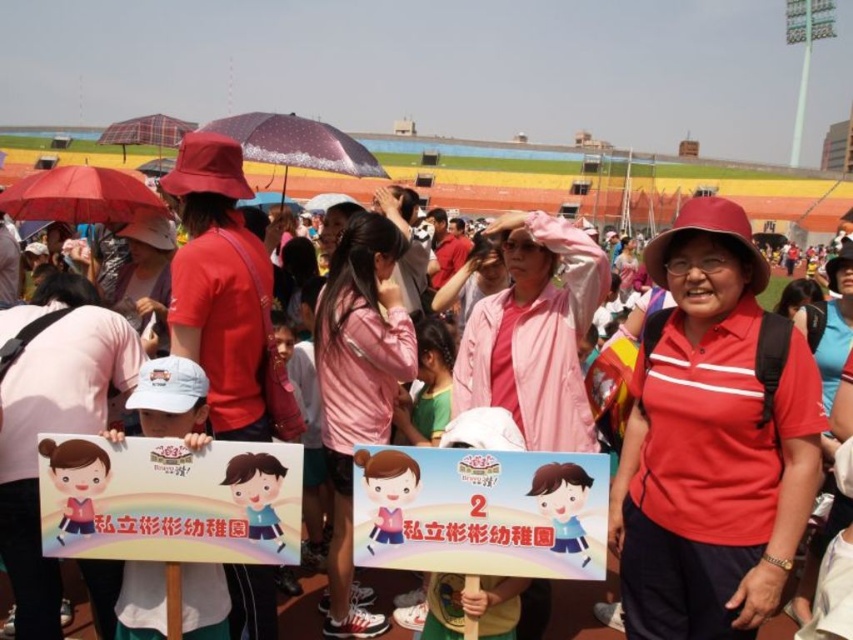
Question: Which point is farther from the camera taking this photo?

Choices:
 (A) (144, 204)
 (B) (349, 605)

Answer: (A)

Question: Does pink fabric jacket at center appear on the left side of sparkly purple umbrella at center?

Choices:
 (A) no
 (B) yes

Answer: (A)

Question: Which object is closer to the camera taking this photo?

Choices:
 (A) plaid fabric umbrella at upper left
 (B) sparkly purple umbrella at center
 (C) pink fabric jacket at center
 (D) matte red umbrella at left

Answer: (C)

Question: Which point is farther to the camera?

Choices:
 (A) pink fabric jacket at center
 (B) matte red umbrella at left

Answer: (B)

Question: Can you confirm if sparkly purple umbrella at center is wider than plaid fabric umbrella at upper left?

Choices:
 (A) no
 (B) yes

Answer: (A)

Question: Can you confirm if pink fabric jacket at center is positioned to the left of matte red umbrella at left?

Choices:
 (A) no
 (B) yes

Answer: (A)